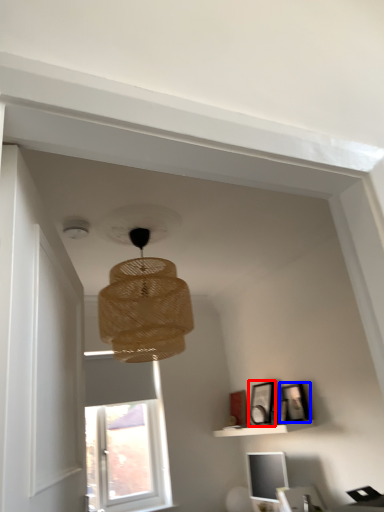
Question: Which object is further to the camera taking this photo, picture frame (highlighted by a red box) or picture frame (highlighted by a blue box)?

Choices:
 (A) picture frame
 (B) picture frame

Answer: (A)